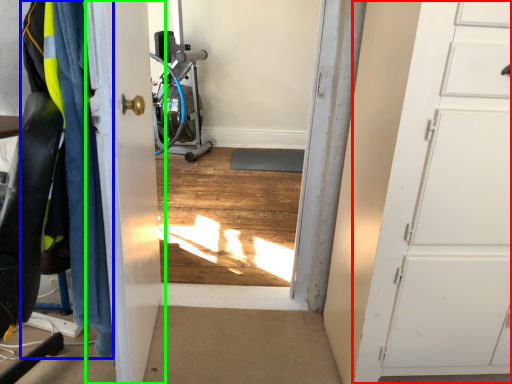
Question: Based on their relative distances, which object is farther from door (highlighted by a red box)? Choose from clothing (highlighted by a blue box) and door (highlighted by a green box).

Choices:
 (A) clothing
 (B) door

Answer: (A)